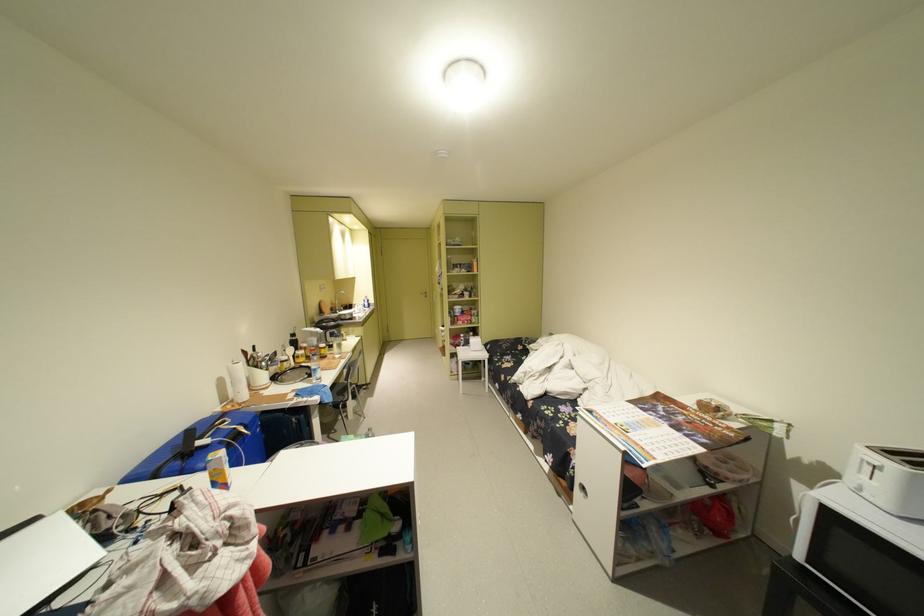
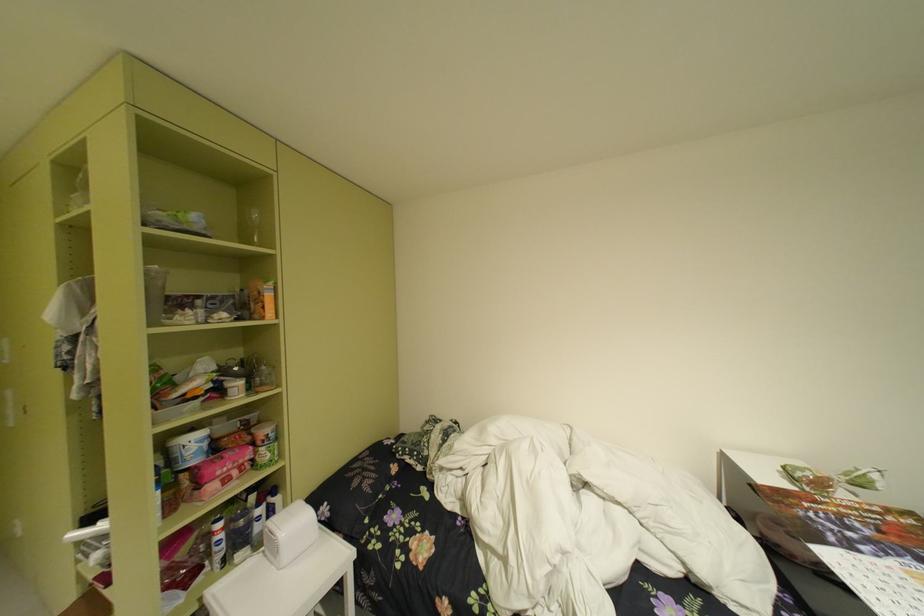
The point at (x=476, y=315) is marked in the first image. Where is the corresponding point in the second image?

(238, 455)